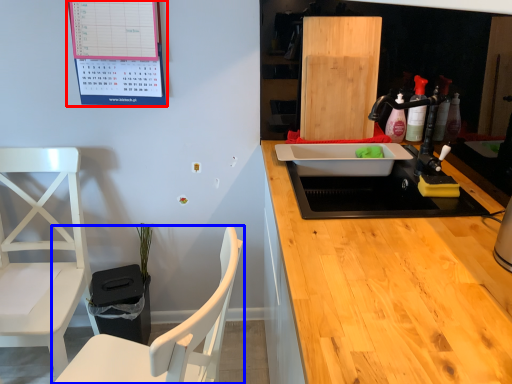
Question: Which of the following is the farthest to the observer, bulletin board (highlighted by a red box) or chair (highlighted by a blue box)?

Choices:
 (A) bulletin board
 (B) chair

Answer: (A)